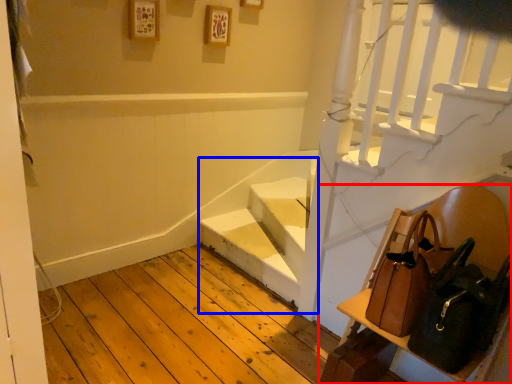
Question: Which of the following is the farthest to the observer, furniture (highlighted by a red box) or stairwell (highlighted by a blue box)?

Choices:
 (A) furniture
 (B) stairwell

Answer: (B)